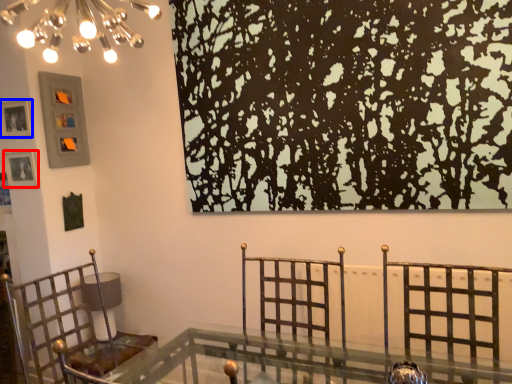
Question: Among these objects, which one is farthest to the camera, picture frame (highlighted by a red box) or picture frame (highlighted by a blue box)?

Choices:
 (A) picture frame
 (B) picture frame

Answer: (A)